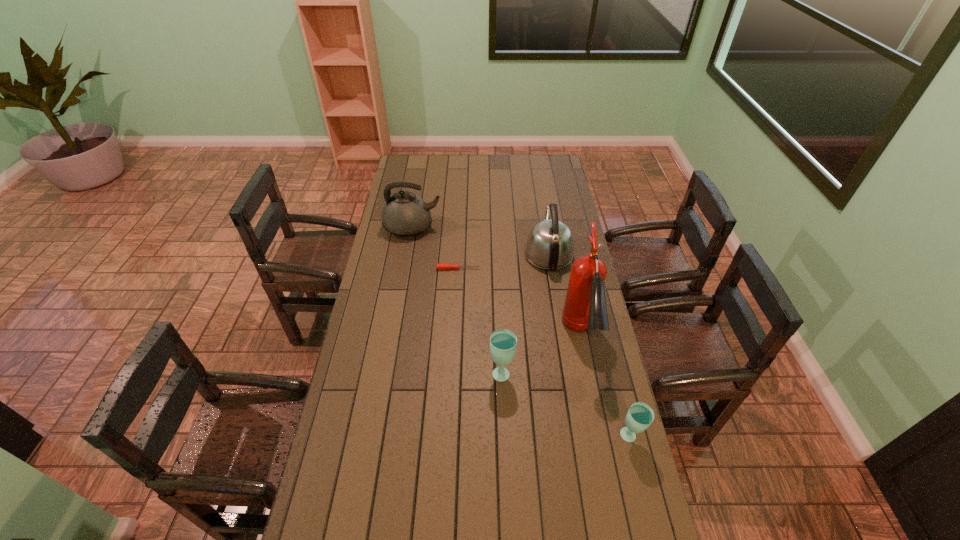
The height and width of the screenshot is (540, 960). Identify the location of the left glass. pyautogui.click(x=503, y=342).

Identify the location of the taller glass. This screenshot has width=960, height=540. (503, 342).

The width and height of the screenshot is (960, 540). I want to click on the right glass, so click(640, 415).

Where is `the fifth tallest object`? The height and width of the screenshot is (540, 960). the fifth tallest object is located at coordinates (640, 415).

You are a GUI agent. You are given a task and a screenshot of the screen. Output one action in this format:
    pyautogui.click(x=<x>, y=<y>)
    Task: Click on the tallest object
    The height and width of the screenshot is (540, 960).
    Given the screenshot: What is the action you would take?
    pyautogui.click(x=585, y=308)

Identify the location of the shortest object. (439, 266).

Identify the location of the right kettle. (550, 245).

This screenshot has width=960, height=540. I want to click on the left kettle, so click(x=405, y=214).

Where is `vacant space situated 0.290m on the front of the taller glass`? This screenshot has height=540, width=960. vacant space situated 0.290m on the front of the taller glass is located at coordinates (506, 470).

I want to click on free space located 0.360m on the left of the nearer glass, so click(x=502, y=437).